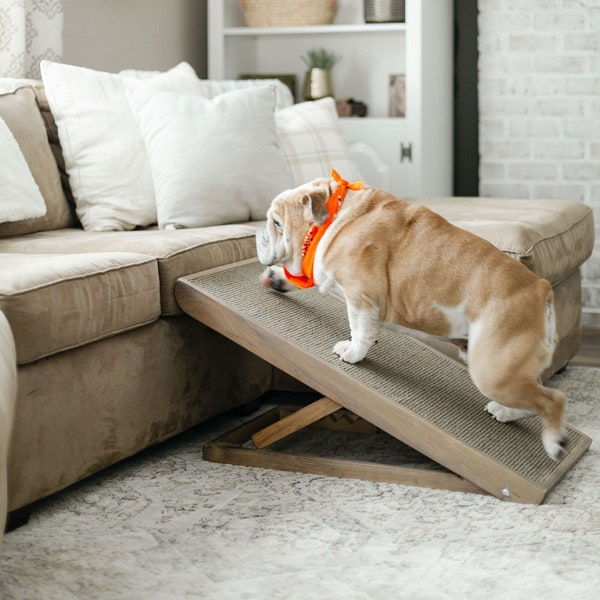
I want to click on plant, so click(323, 55).